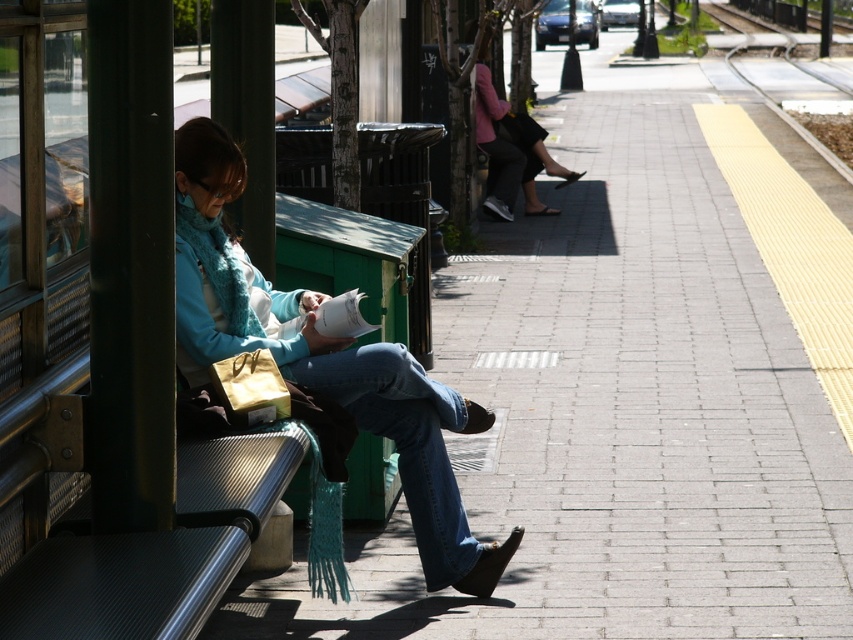
Does blue denim jeans at center have a lesser width compared to pink fabric jacket at upper center?

In fact, blue denim jeans at center might be wider than pink fabric jacket at upper center.

Who is more distant from viewer, (367,406) or (560,182)?

The point (560,182) is behind.

Where is `blue denim jeans at center`? Image resolution: width=853 pixels, height=640 pixels. blue denim jeans at center is located at coordinates (322, 360).